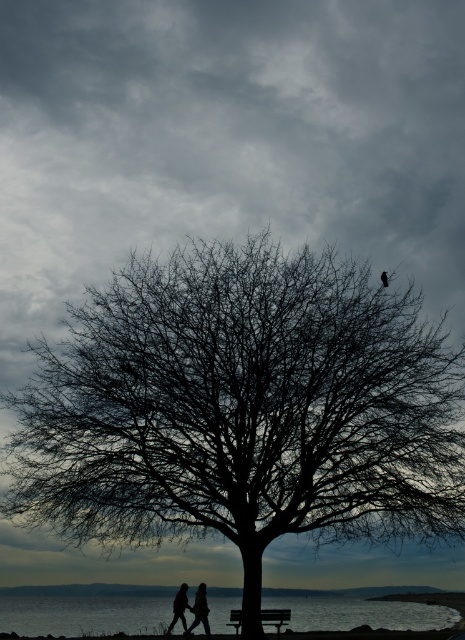
Question: Is the position of smooth sand at lower center less distant than that of silhouette figures at center?

Choices:
 (A) no
 (B) yes

Answer: (B)

Question: Which of the following is the closest to the observer?

Choices:
 (A) smooth sand at lower center
 (B) silvery water at lower center
 (C) black bare tree at center

Answer: (C)

Question: Which object appears farthest from the camera in this image?

Choices:
 (A) black bare tree at center
 (B) silhouette figures at center
 (C) wooden bench at center

Answer: (B)

Question: Can you confirm if silvery water at lower center is thinner than silhouette figures at center?

Choices:
 (A) no
 (B) yes

Answer: (A)

Question: Is silvery water at lower center closer to the viewer compared to smooth sand at lower center?

Choices:
 (A) yes
 (B) no

Answer: (B)

Question: Which point appears farthest from the camera in this image?

Choices:
 (A) (270, 625)
 (B) (283, 452)
 (C) (378, 604)

Answer: (C)